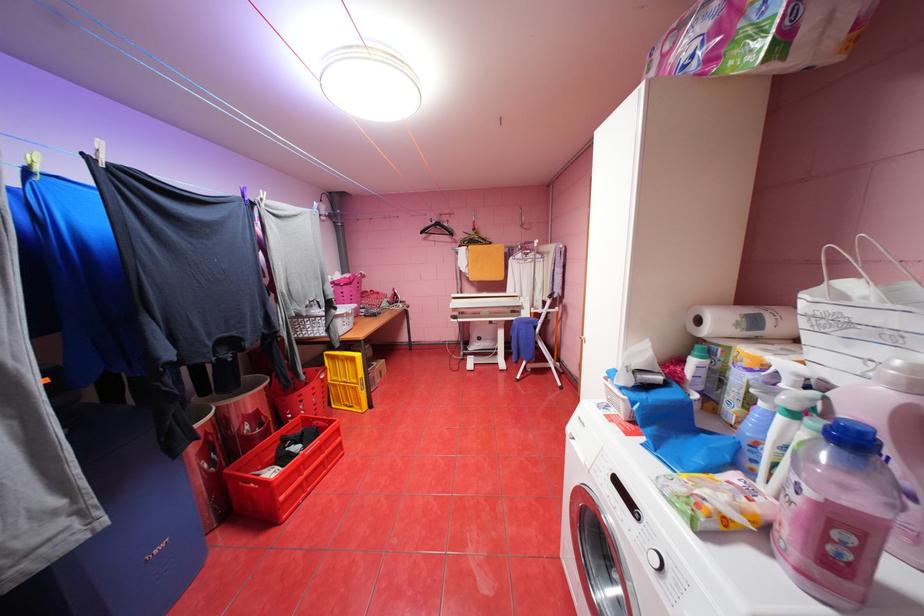
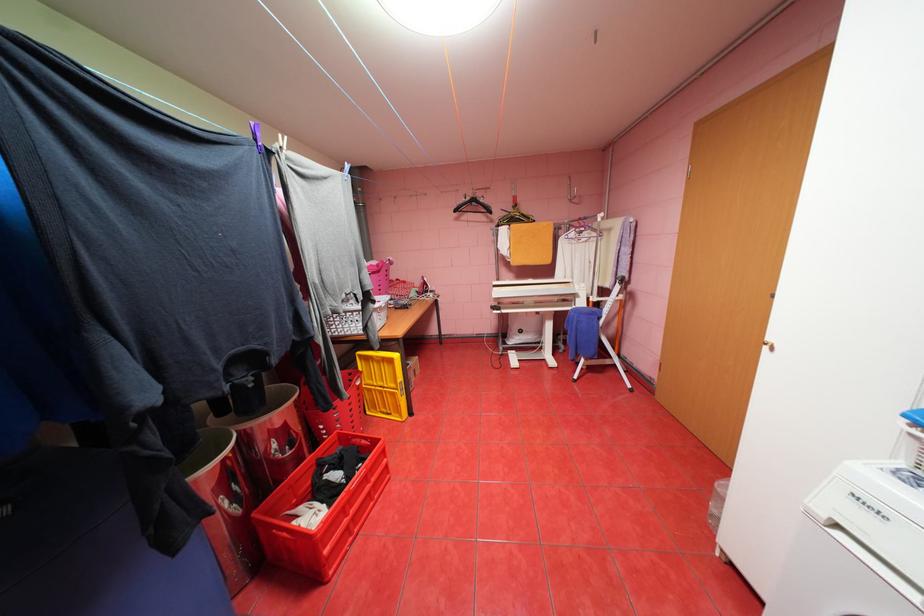
Where in the second image is the point corresponding to (x=581, y=437) from the first image?

(845, 525)